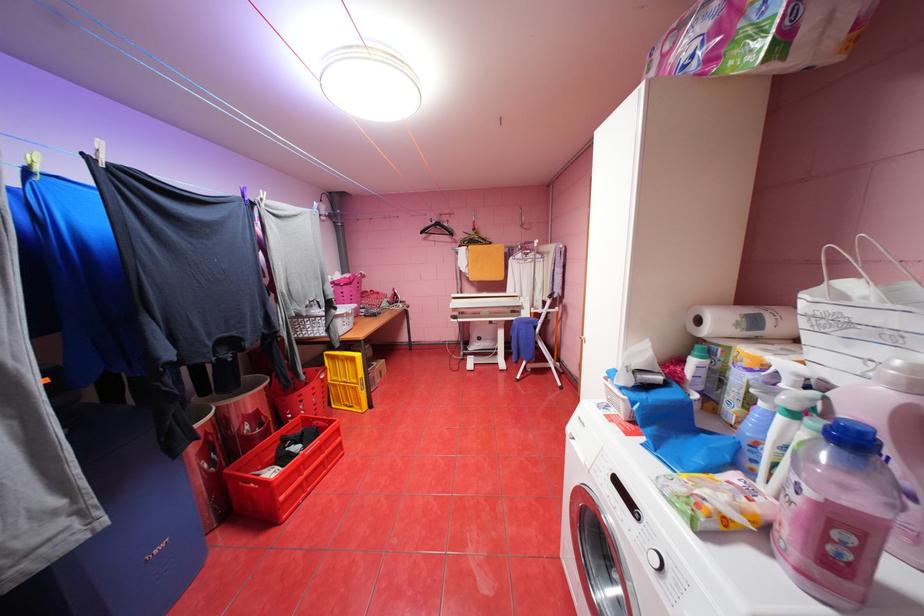
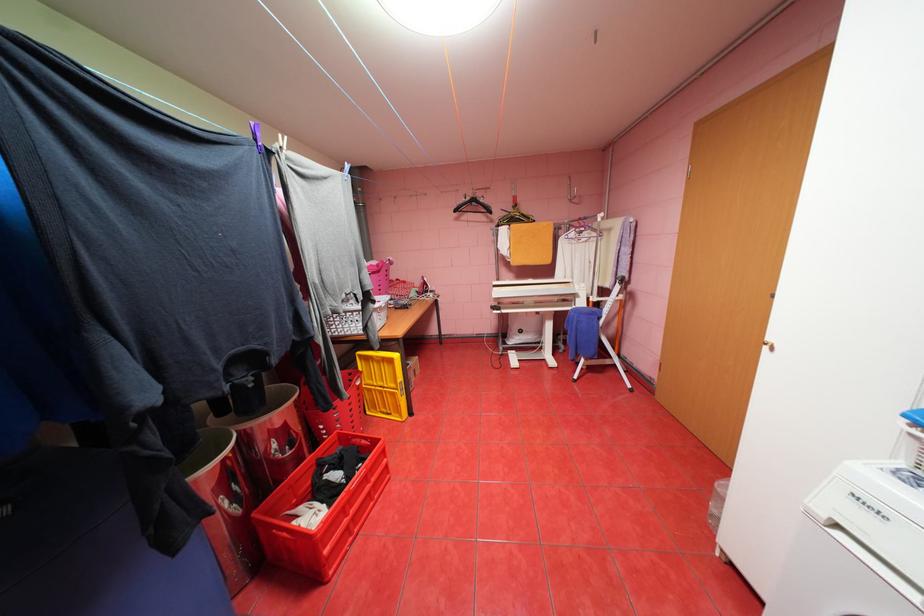
Where in the second image is the point corresponding to (x=581, y=437) from the first image?

(845, 525)